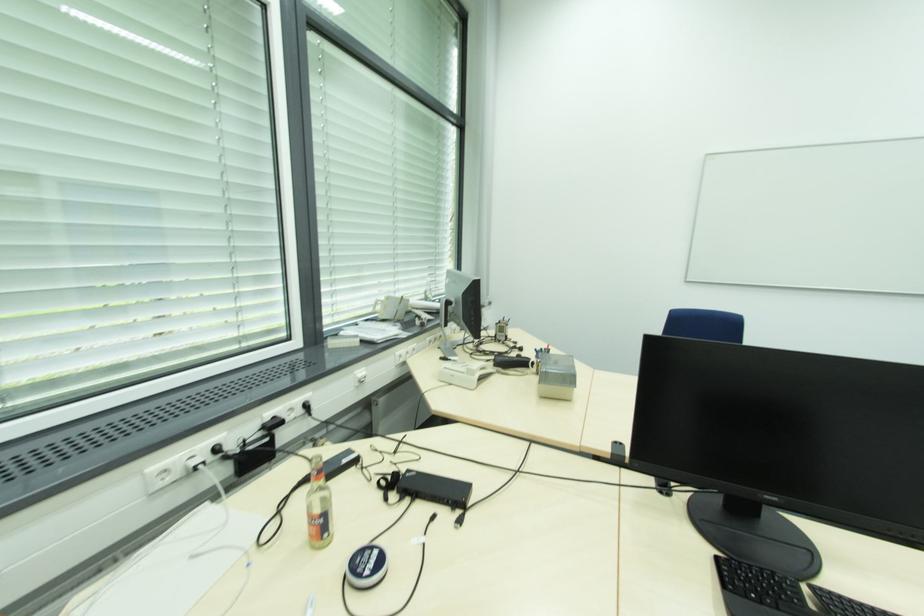
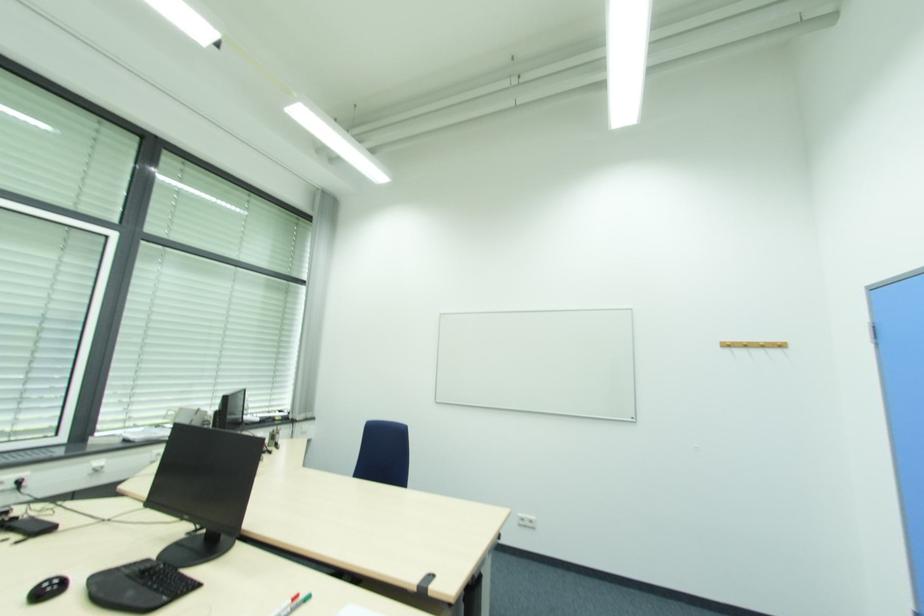
Find the pixel in the second image that matches the point at 306,411 in the first image.

(17, 487)